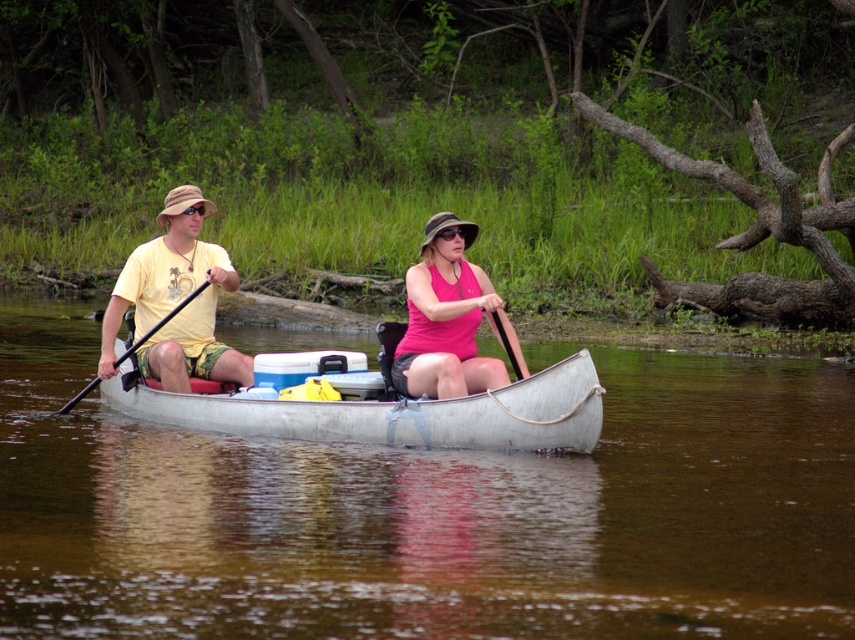
From the picture: Which is below, matte yellow t-shirt at center or matte yellow t-shirt at left?

matte yellow t-shirt at left is lower down.

How far apart are matte yellow t-shirt at center and matte yellow t-shirt at left?

The distance of matte yellow t-shirt at center from matte yellow t-shirt at left is 4.74 centimeters.

Describe the element at coordinates (175, 300) in the screenshot. I see `matte yellow t-shirt at center` at that location.

The image size is (855, 640). I want to click on matte yellow t-shirt at center, so click(x=175, y=300).

How far apart are white matte canoe at center and pink fabric tank top at center?

white matte canoe at center and pink fabric tank top at center are 37.54 inches apart from each other.

Is white matte canoe at center further to camera compared to pink fabric tank top at center?

No, it is in front of pink fabric tank top at center.

Identify the location of white matte canoe at center. The height and width of the screenshot is (640, 855). (399, 413).

Where is `white matte canoe at center`? This screenshot has height=640, width=855. white matte canoe at center is located at coordinates (399, 413).

Does white matte canoe at center have a lesser width compared to black plastic paddle at left?

No, white matte canoe at center is not thinner than black plastic paddle at left.

Is white matte canoe at center positioned at the back of black plastic paddle at left?

No, white matte canoe at center is in front of black plastic paddle at left.

Is point (506, 445) in front of point (118, 362)?

Yes, it is in front of point (118, 362).

This screenshot has height=640, width=855. Identify the location of white matte canoe at center. (399, 413).